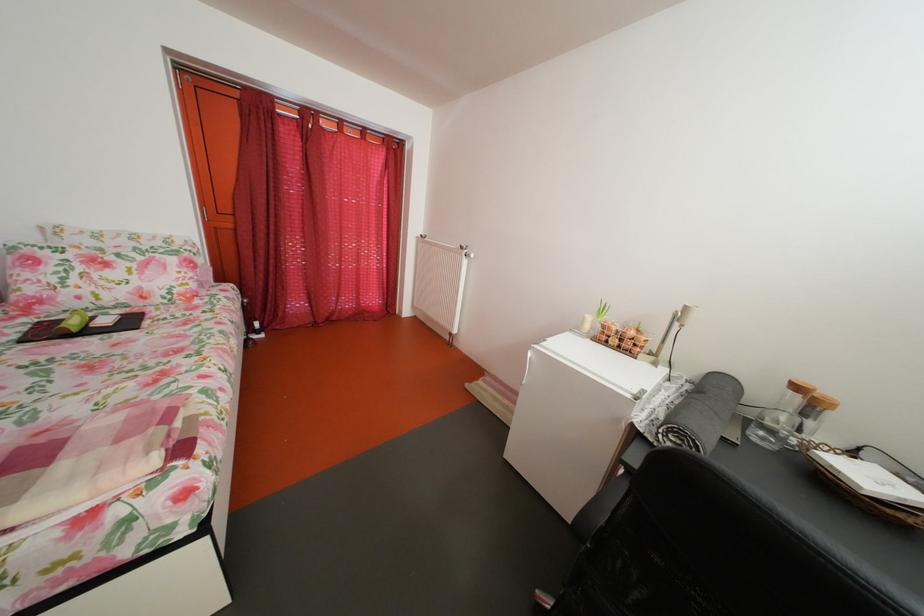
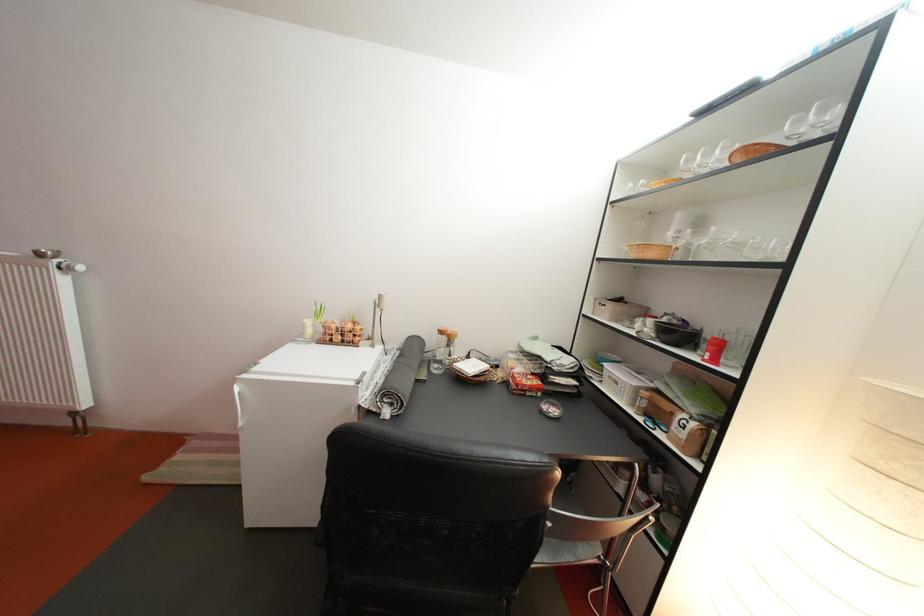
In the second image, find the point that corresponds to (808,394) in the first image.

(453, 339)